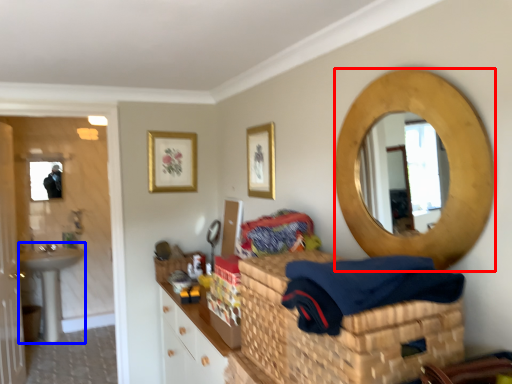
Question: Which of the following is the farthest to the observer, oval (highlighted by a red box) or sink (highlighted by a blue box)?

Choices:
 (A) oval
 (B) sink

Answer: (B)